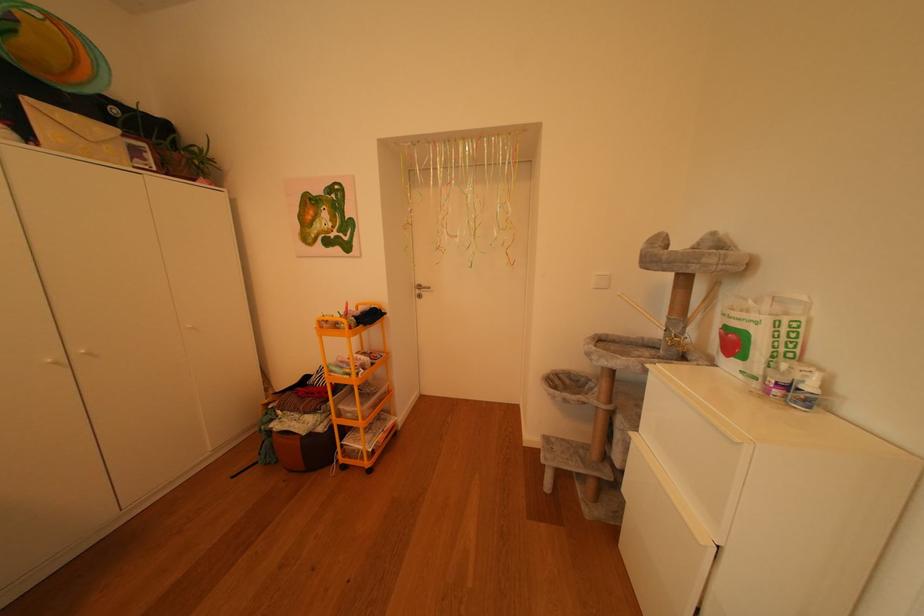
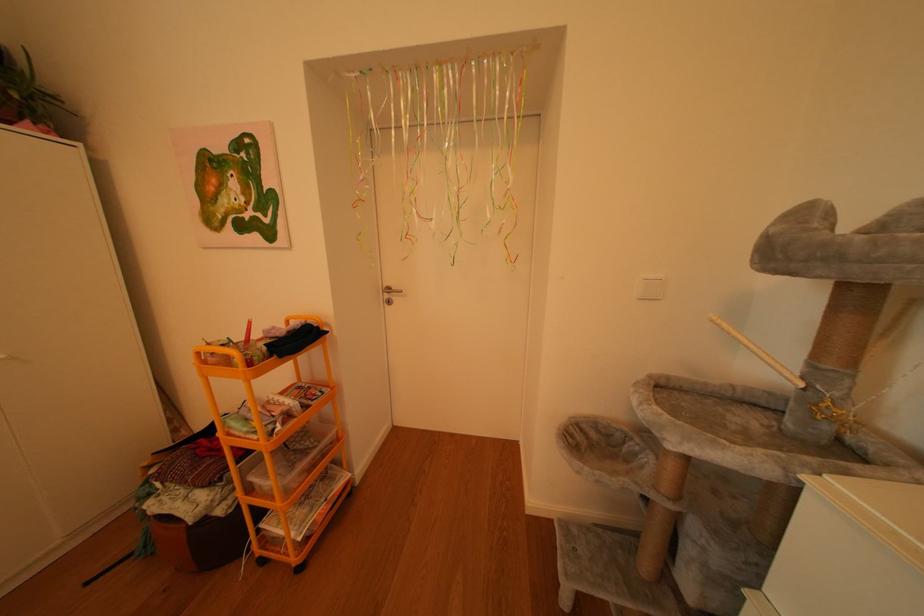
Question: The images are taken continuously from a first-person perspective. In which direction is your viewpoint rotating?

Choices:
 (A) Left
 (B) Right
 (C) Up
 (D) Down

Answer: (B)